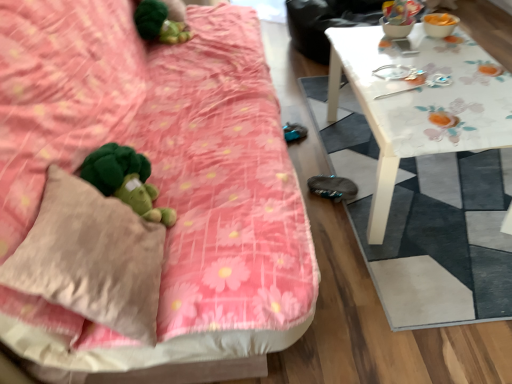
Question: Choose the correct answer: Is green plush toy at upper left inside white floral-patterned mat at right or outside it?

Choices:
 (A) outside
 (B) inside

Answer: (A)

Question: Looking at their shapes, would you say green plush toy at upper left is wider or thinner than white floral-patterned mat at right?

Choices:
 (A) wide
 (B) thin

Answer: (B)

Question: Which object is the closest to the green plush toy at lower left?

Choices:
 (A) white glossy table at upper right
 (B) white floral-patterned mat at right
 (C) beige fabric pillow at lower left
 (D) pink floral fabric couch at center
 (E) green plush toy at upper left

Answer: (C)

Question: Which object is the closest to the white glossy table at upper right?

Choices:
 (A) white floral-patterned mat at right
 (B) beige fabric pillow at lower left
 (C) green plush toy at lower left
 (D) green plush toy at upper left
 (E) pink floral fabric couch at center

Answer: (A)